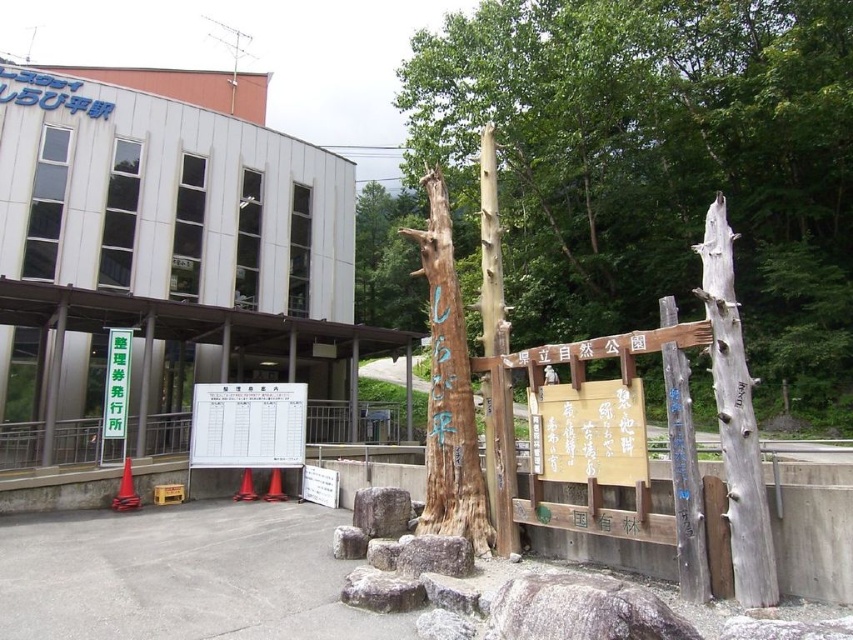
Who is taller, wooden signpost at center or gray weathered wood totem pole at right?

wooden signpost at center is taller.

Does wooden signpost at center have a greater width compared to gray weathered wood totem pole at right?

Correct, the width of wooden signpost at center exceeds that of gray weathered wood totem pole at right.

Between point (618, 232) and point (761, 544), which one is positioned in front?

Point (761, 544) is more forward.

I want to click on wooden signpost at center, so click(x=659, y=164).

Who is higher up, natural wood signpost at center or white plastic signboard at center?

Positioned higher is natural wood signpost at center.

Is natural wood signpost at center behind white plastic signboard at center?

No, natural wood signpost at center is closer to the viewer.

Does point (474, 529) lie behind point (131, 435)?

No, it is in front of (131, 435).

What are the coordinates of `natural wood signpost at center` in the screenshot? It's located at (448, 390).

Image resolution: width=853 pixels, height=640 pixels. Describe the element at coordinates (659, 164) in the screenshot. I see `wooden signpost at center` at that location.

The height and width of the screenshot is (640, 853). In order to click on wooden signpost at center in this screenshot , I will do `click(659, 164)`.